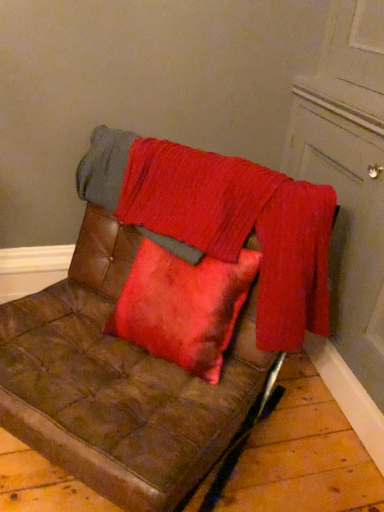
Question: Is matte white door at upper right at the back of brown leather couch at center?

Choices:
 (A) no
 (B) yes

Answer: (A)

Question: Can you confirm if brown leather couch at center is positioned to the left of matte white door at upper right?

Choices:
 (A) no
 (B) yes

Answer: (B)

Question: Is brown leather couch at center closer to the viewer compared to matte white door at upper right?

Choices:
 (A) no
 (B) yes

Answer: (B)

Question: Is brown leather couch at center positioned far away from matte white door at upper right?

Choices:
 (A) no
 (B) yes

Answer: (A)

Question: Is brown leather couch at center at the right side of matte white door at upper right?

Choices:
 (A) yes
 (B) no

Answer: (B)

Question: Is velvet red blanket at center wider or thinner than matte white door at upper right?

Choices:
 (A) wide
 (B) thin

Answer: (B)

Question: From a real-world perspective, is velvet red blanket at center above or below matte white door at upper right?

Choices:
 (A) below
 (B) above

Answer: (A)

Question: From their relative heights in the image, would you say velvet red blanket at center is taller or shorter than matte white door at upper right?

Choices:
 (A) tall
 (B) short

Answer: (B)

Question: Does point (266, 245) appear closer or farther from the camera than point (375, 190)?

Choices:
 (A) closer
 (B) farther

Answer: (A)

Question: Looking at their shapes, would you say brown leather couch at center is wider or thinner than velvet red blanket at center?

Choices:
 (A) thin
 (B) wide

Answer: (B)

Question: From a real-world perspective, is brown leather couch at center physically located above or below velvet red blanket at center?

Choices:
 (A) above
 (B) below

Answer: (B)

Question: From the image's perspective, is brown leather couch at center above or below velvet red blanket at center?

Choices:
 (A) below
 (B) above

Answer: (A)

Question: In the image, is brown leather couch at center on the left side or the right side of velvet red blanket at center?

Choices:
 (A) right
 (B) left

Answer: (B)

Question: From a real-world perspective, is matte white door at upper right above or below velvet red blanket at center?

Choices:
 (A) above
 (B) below

Answer: (A)

Question: Considering the positions of matte white door at upper right and velvet red blanket at center in the image, is matte white door at upper right taller or shorter than velvet red blanket at center?

Choices:
 (A) short
 (B) tall

Answer: (B)